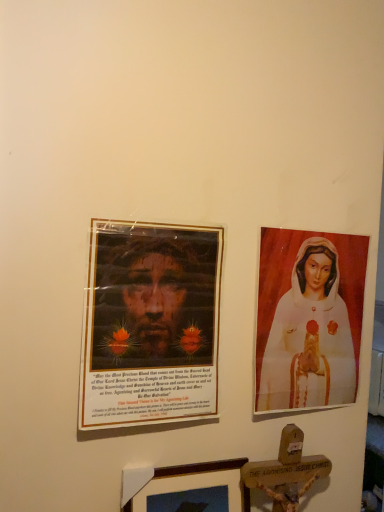
This screenshot has width=384, height=512. Describe the element at coordinates (308, 336) in the screenshot. I see `white glossy statue at right` at that location.

At what (x,y) coordinates should I click in order to perform the action: click on white glossy statue at right. Please return your answer as a coordinate pair (x, y). Looking at the image, I should click on (308, 336).

Measure the distance between point [276,337] and camera.

38.62 inches.

What do you see at coordinates (182, 480) in the screenshot? I see `wooden picture frame at lower center` at bounding box center [182, 480].

The image size is (384, 512). I want to click on wooden picture frame at lower center, so click(182, 480).

Where is `white glossy statue at right`? white glossy statue at right is located at coordinates (308, 336).

From the picture: Does wooden picture frame at lower center appear on the left side of white glossy statue at right?

Correct, you'll find wooden picture frame at lower center to the left of white glossy statue at right.

Considering the positions of objects wooden picture frame at lower center and white glossy statue at right in the image provided, who is behind, wooden picture frame at lower center or white glossy statue at right?

white glossy statue at right is further from the camera.

Is point (122, 495) closer to camera compared to point (330, 402)?

Yes, point (122, 495) is closer to viewer.

From the image's perspective, is wooden picture frame at lower center beneath white glossy statue at right?

Yes, from the image's perspective, wooden picture frame at lower center is beneath white glossy statue at right.

From a real-world perspective, relative to white glossy statue at right, is wooden picture frame at lower center vertically above or below?

In terms of real-world spatial position, wooden picture frame at lower center is below white glossy statue at right.

Based on the photo, between wooden picture frame at lower center and white glossy statue at right, which one has smaller width?

With smaller width is white glossy statue at right.

Who is shorter, wooden picture frame at lower center or white glossy statue at right?

With less height is wooden picture frame at lower center.

Based on their sizes in the image, would you say wooden picture frame at lower center is bigger or smaller than white glossy statue at right?

In the image, wooden picture frame at lower center appears to be smaller than white glossy statue at right.

Is white glossy statue at right completely or partially inside wooden picture frame at lower center?

No, white glossy statue at right is not surrounded by wooden picture frame at lower center.

Is wooden picture frame at lower center with white glossy statue at right?

No, wooden picture frame at lower center is not with white glossy statue at right.

From the picture: Is wooden picture frame at lower center positioned with its back to white glossy statue at right?

No.

Looking at this image, how many degrees apart are the facing directions of wooden picture frame at lower center and white glossy statue at right?

wooden picture frame at lower center and white glossy statue at right are facing 1.78 degrees away from each other.

You are a GUI agent. You are given a task and a screenshot of the screen. Output one action in this format:
    pyautogui.click(x=<x>, y=<y>)
    Task: Click on the woman on the right of wooden picture frame at lower center
    
    Given the screenshot: What is the action you would take?
    pyautogui.click(x=308, y=336)

Is white glossy statue at right to the left of wooden picture frame at lower center from the viewer's perspective?

No, white glossy statue at right is not to the left of wooden picture frame at lower center.

Is the depth of white glossy statue at right greater than that of wooden picture frame at lower center?

Yes, white glossy statue at right is behind wooden picture frame at lower center.

Is point (283, 405) farther from camera compared to point (167, 485)?

That is True.

From the image's perspective, is white glossy statue at right positioned above or below wooden picture frame at lower center?

white glossy statue at right is situated higher than wooden picture frame at lower center in the image.

From a real-world perspective, is white glossy statue at right beneath wooden picture frame at lower center?

No, from a real-world perspective, white glossy statue at right is not beneath wooden picture frame at lower center.

Considering the sizes of objects white glossy statue at right and wooden picture frame at lower center in the image provided, who is wider, white glossy statue at right or wooden picture frame at lower center?

wooden picture frame at lower center is wider.

From the picture: Does white glossy statue at right have a lesser height compared to wooden picture frame at lower center?

In fact, white glossy statue at right may be taller than wooden picture frame at lower center.

Based on their sizes in the image, would you say white glossy statue at right is bigger or smaller than wooden picture frame at lower center?

Clearly, white glossy statue at right is larger in size than wooden picture frame at lower center.

Is white glossy statue at right not within wooden picture frame at lower center?

That's correct, white glossy statue at right is outside of wooden picture frame at lower center.

Are white glossy statue at right and wooden picture frame at lower center beside each other?

white glossy statue at right and wooden picture frame at lower center are not in contact.

Is white glossy statue at right turned away from wooden picture frame at lower center?

No, white glossy statue at right's orientation is not away from wooden picture frame at lower center.

How distant is white glossy statue at right from wooden picture frame at lower center?

white glossy statue at right and wooden picture frame at lower center are 31.30 centimeters apart.

This screenshot has height=512, width=384. Identify the location of picture frame below the white glossy statue at right (from the image's perspective). (182, 480).

The image size is (384, 512). What are the coordinates of `woman to the right of wooden picture frame at lower center` in the screenshot? It's located at (308, 336).

Locate an element on the screen. woman that appears above the wooden picture frame at lower center (from a real-world perspective) is located at coordinates (308, 336).